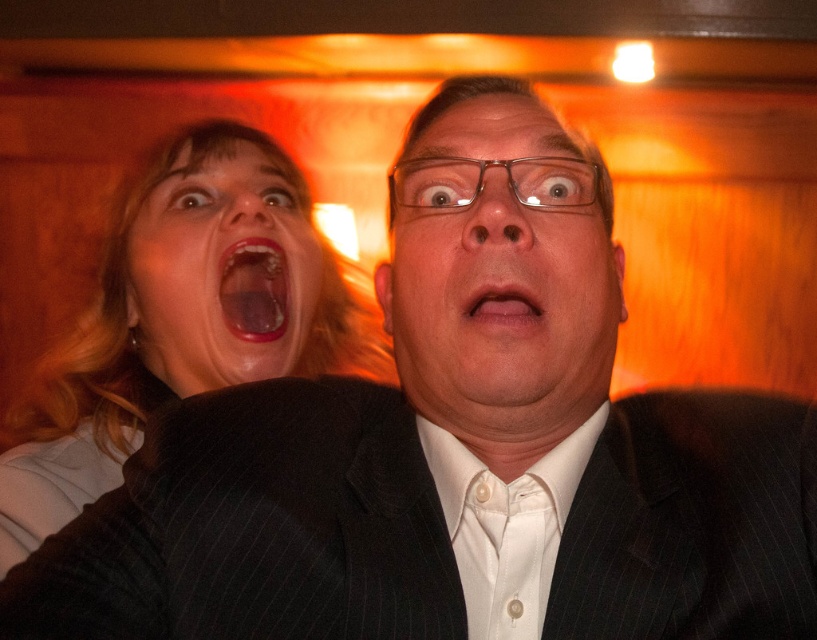
You are a photographer setting up for a group photo and need to ensure that both the black pinstripe suit at center and the white satin tie at center are clearly visible in the frame. Given that your camera has a minimum focus distance of 4 inches, will you be able to capture both items without moving closer?

The black pinstripe suit at center and white satin tie at center are 4.11 inches apart, so yes, the camera can focus on both items since the distance between them is slightly more than the minimum focus distance of 4 inches.

You are a photographer setting up a shoot in a dimly lit indoor space. You need to ensure that the matte black suit at center and the white satin tie at center are both visible in your photo. Considering their sizes, which object should you focus on to capture both clearly?

The matte black suit at center is taller than the white satin tie at center, so focusing on the matte black suit at center would ensure both are visible as it is larger and can be the main focus while the smaller white satin tie at center remains in frame.